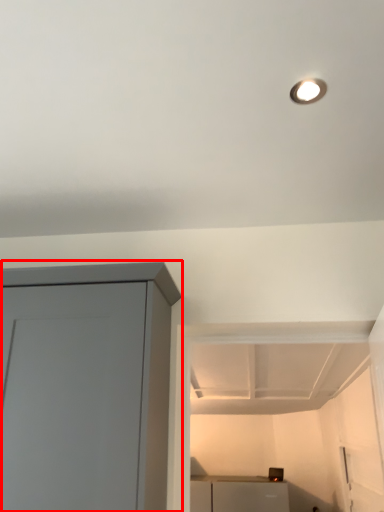
Question: From the image's perspective, what is the correct spatial positioning of cupboard (annotated by the red box) in reference to appliance?

Choices:
 (A) below
 (B) above

Answer: (B)